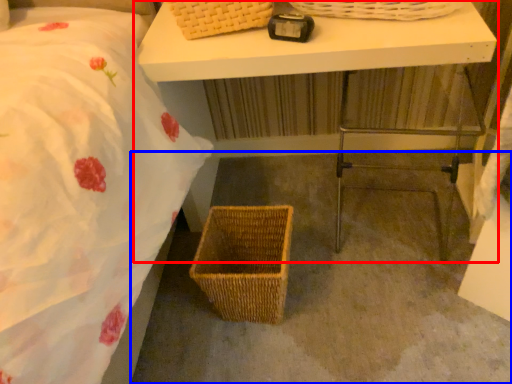
Question: Which of the following is the closest to the observer, table (highlighted by a red box) or concrete (highlighted by a blue box)?

Choices:
 (A) table
 (B) concrete

Answer: (A)